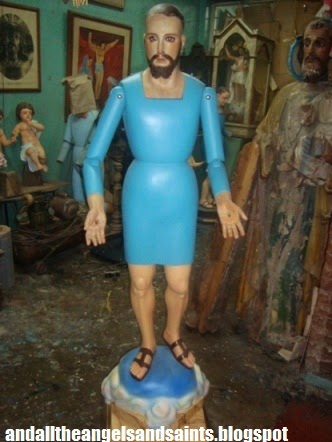
Where is `jesus uin painting`? The image size is (332, 442). jesus uin painting is located at coordinates (101, 55).